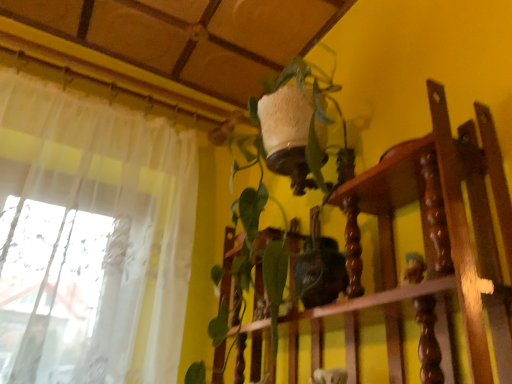
What is the approximate width of white textured vase at upper center?

white textured vase at upper center is 23.62 centimeters in width.

Measure the distance between point (428, 89) and camera.

A distance of 25.79 inches exists between point (428, 89) and camera.

This screenshot has width=512, height=384. Find the location of `white textured vase at upper center`. white textured vase at upper center is located at coordinates (423, 234).

The width and height of the screenshot is (512, 384). Describe the element at coordinates (423, 234) in the screenshot. I see `white textured vase at upper center` at that location.

The width and height of the screenshot is (512, 384). What do you see at coordinates (285, 158) in the screenshot?
I see `green matte plant at center` at bounding box center [285, 158].

Measure the distance between green matte plant at center and camera.

green matte plant at center and camera are 31.42 inches apart.

Find the location of `green matte plant at center`. green matte plant at center is located at coordinates (285, 158).

Find the location of a particular element. The width and height of the screenshot is (512, 384). white textured vase at upper center is located at coordinates (423, 234).

Is green matte plant at center at the right side of white textured vase at upper center?

No, green matte plant at center is not to the right of white textured vase at upper center.

Is green matte plant at center positioned before white textured vase at upper center?

No, green matte plant at center is behind white textured vase at upper center.

Which is closer, [253,216] or [379,219]?

Point [253,216].

From the image's perspective, would you say green matte plant at center is shown under white textured vase at upper center?

Incorrect, from the image's perspective, green matte plant at center is higher than white textured vase at upper center.

From a real-world perspective, is green matte plant at center positioned above or below white textured vase at upper center?

From a real-world perspective, green matte plant at center is physically above white textured vase at upper center.

Does green matte plant at center have a greater width compared to white textured vase at upper center?

Indeed, green matte plant at center has a greater width compared to white textured vase at upper center.

Can you confirm if green matte plant at center is taller than white textured vase at upper center?

Yes, green matte plant at center is taller than white textured vase at upper center.

Between green matte plant at center and white textured vase at upper center, which one has smaller size?

Smaller between the two is white textured vase at upper center.

Does green matte plant at center contain white textured vase at upper center?

Yes, white textured vase at upper center is a part of green matte plant at center.

Would you consider green matte plant at center to be distant from white textured vase at upper center?

They are positioned close to each other.

Is green matte plant at center turned away from white textured vase at upper center?

Yes, white textured vase at upper center is at the back of green matte plant at center.

Find the location of a particular element. The width and height of the screenshot is (512, 384). furniture that is on the right side of green matte plant at center is located at coordinates (423, 234).

Which object is positioned more to the right, white textured vase at upper center or green matte plant at center?

white textured vase at upper center.

Does white textured vase at upper center come behind green matte plant at center?

No, it is in front of green matte plant at center.

Between point (410, 186) and point (263, 183), which one is positioned in front?

The point (410, 186) is closer to the camera.

From the image's perspective, which one is positioned higher, white textured vase at upper center or green matte plant at center?

green matte plant at center.

From a real-world perspective, is white textured vase at upper center physically below green matte plant at center?

Yes, from a real-world perspective, white textured vase at upper center is below green matte plant at center.

Considering the sizes of objects white textured vase at upper center and green matte plant at center in the image provided, who is wider, white textured vase at upper center or green matte plant at center?

green matte plant at center.

Does white textured vase at upper center have a greater height compared to green matte plant at center?

In fact, white textured vase at upper center may be shorter than green matte plant at center.

Who is bigger, white textured vase at upper center or green matte plant at center?

green matte plant at center is bigger.

Is white textured vase at upper center inside or outside of green matte plant at center?

white textured vase at upper center lies within the bounds of green matte plant at center.

Is white textured vase at upper center far away from green matte plant at center?

No, white textured vase at upper center is in close proximity to green matte plant at center.

Could you tell me if white textured vase at upper center is facing green matte plant at center?

Yes, white textured vase at upper center is facing green matte plant at center.

How different are the orientations of white textured vase at upper center and green matte plant at center in degrees?

The angular difference between white textured vase at upper center and green matte plant at center is 0.000832 degrees.

The height and width of the screenshot is (384, 512). I want to click on furniture that is below the green matte plant at center (from the image's perspective), so (x=423, y=234).

Where is `vegetation behind the white textured vase at upper center`? The image size is (512, 384). vegetation behind the white textured vase at upper center is located at coordinates (285, 158).

Where is `furniture that appears below the green matte plant at center (from the image's perspective)`? The width and height of the screenshot is (512, 384). furniture that appears below the green matte plant at center (from the image's perspective) is located at coordinates (423, 234).